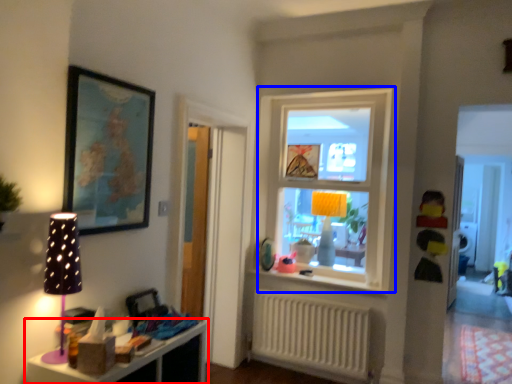
Question: Among these objects, which one is farthest to the camera, shelf (highlighted by a red box) or window (highlighted by a blue box)?

Choices:
 (A) shelf
 (B) window

Answer: (B)